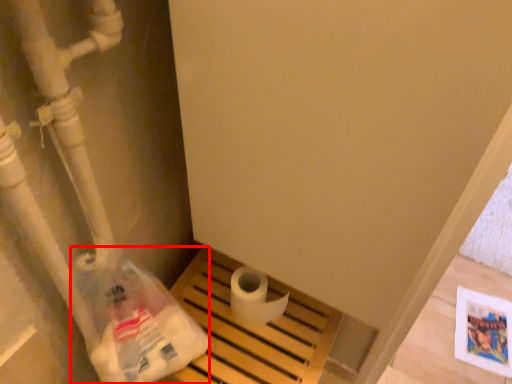
Question: In this image, where is paper bag (annotated by the red box) located relative to toilet paper?

Choices:
 (A) left
 (B) right

Answer: (A)